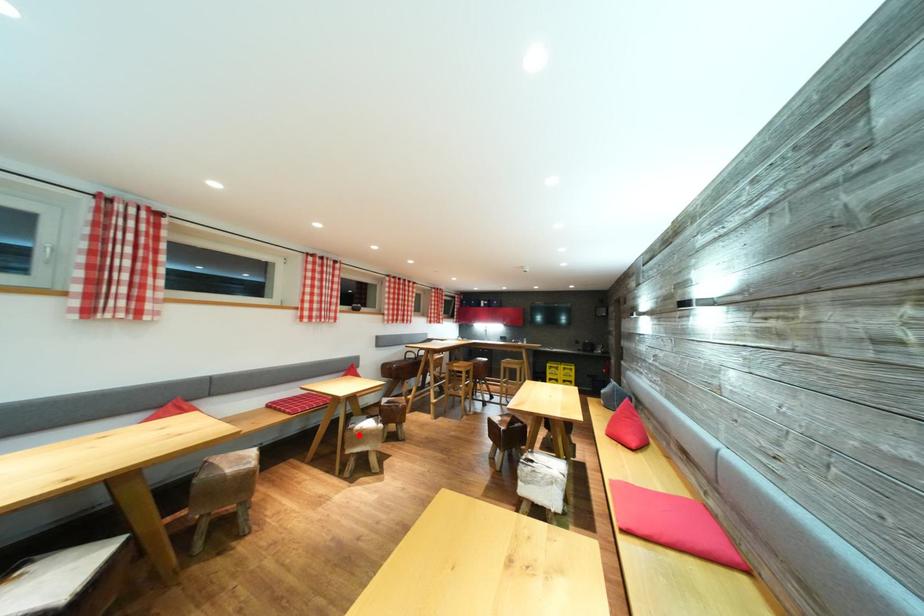
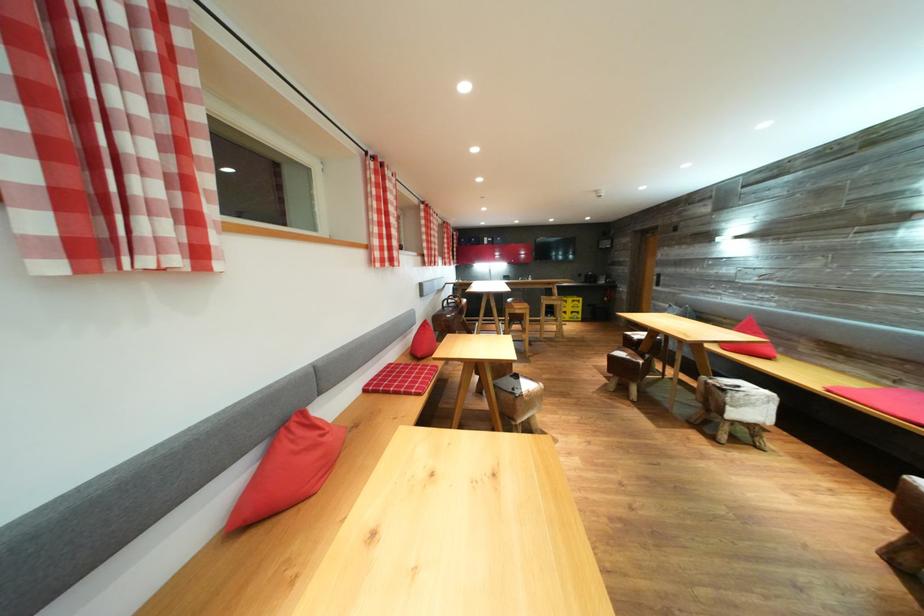
Find the pixel in the second image that matches the highlighted location in the first image.

(528, 400)